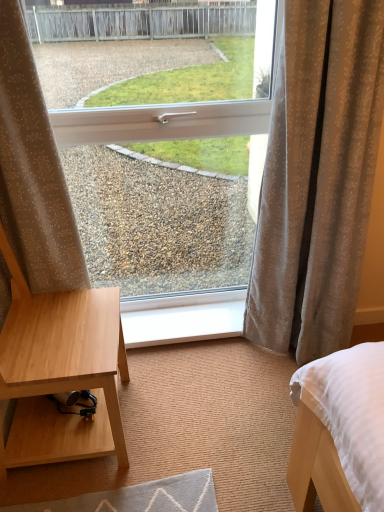
Question: Is white plastic window sill at center wider than beige dotted fabric at left, the first curtain when ordered from left to right?

Choices:
 (A) no
 (B) yes

Answer: (B)

Question: Is white plastic window sill at center positioned before beige dotted fabric at left, the first curtain when ordered from left to right?

Choices:
 (A) yes
 (B) no

Answer: (B)

Question: From the image's perspective, would you say white plastic window sill at center is positioned over beige dotted fabric at left, which is counted as the 2th curtain, starting from the right?

Choices:
 (A) no
 (B) yes

Answer: (A)

Question: From the image's perspective, is white plastic window sill at center under beige dotted fabric at left, the first curtain when ordered from left to right?

Choices:
 (A) no
 (B) yes

Answer: (B)

Question: Could beige dotted fabric at left, which is counted as the 2th curtain, starting from the right, be considered to be inside white plastic window sill at center?

Choices:
 (A) no
 (B) yes

Answer: (A)

Question: Considering the relative sizes of white plastic window sill at center and beige dotted fabric at left, the first curtain when ordered from left to right, in the image provided, is white plastic window sill at center thinner than beige dotted fabric at left, the first curtain when ordered from left to right,?

Choices:
 (A) no
 (B) yes

Answer: (A)

Question: From a real-world perspective, is beige textured curtain at right, acting as the first curtain starting from the right, beneath white plastic window sill at center?

Choices:
 (A) yes
 (B) no

Answer: (B)

Question: Can you confirm if beige textured curtain at right, acting as the first curtain starting from the right, is bigger than white plastic window sill at center?

Choices:
 (A) no
 (B) yes

Answer: (B)

Question: Is beige textured curtain at right, which appears as the 2th curtain when viewed from the left, next to white plastic window sill at center and touching it?

Choices:
 (A) no
 (B) yes

Answer: (A)

Question: Is the position of beige textured curtain at right, which appears as the 2th curtain when viewed from the left, more distant than that of white plastic window sill at center?

Choices:
 (A) yes
 (B) no

Answer: (B)

Question: Is there a large distance between beige textured curtain at right, which appears as the 2th curtain when viewed from the left, and white plastic window sill at center?

Choices:
 (A) no
 (B) yes

Answer: (A)

Question: Is beige textured curtain at right, which appears as the 2th curtain when viewed from the left, thinner than white plastic window sill at center?

Choices:
 (A) yes
 (B) no

Answer: (B)

Question: Is beige textured curtain at right, acting as the first curtain starting from the right, beside white plastic window at center?

Choices:
 (A) yes
 (B) no

Answer: (A)